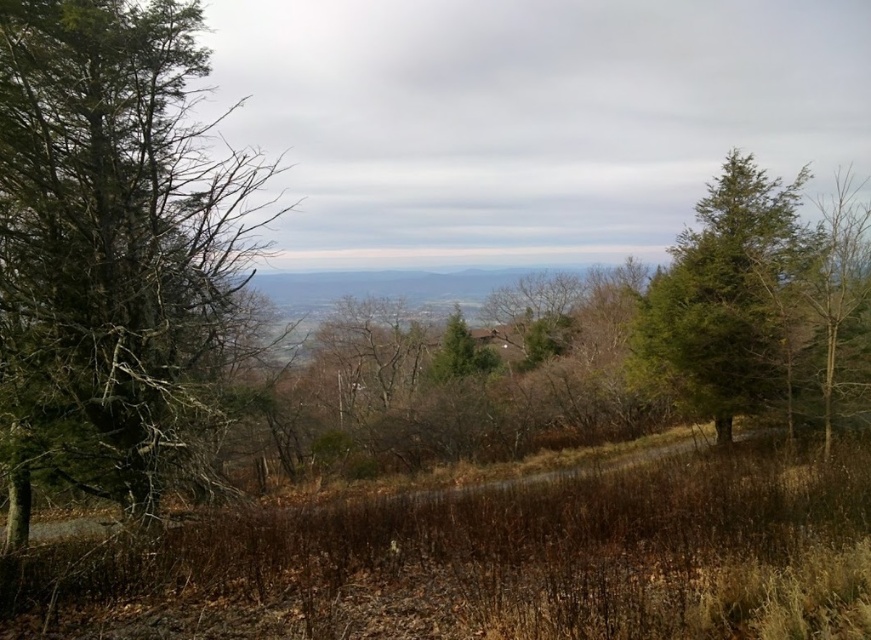
Question: Based on their relative distances, which object is nearer to the green matte tree at right?

Choices:
 (A) green needle-like tree at right
 (B) green matte tree at left

Answer: (A)

Question: Does green matte tree at left have a smaller size compared to green matte tree at right?

Choices:
 (A) yes
 (B) no

Answer: (A)

Question: Is green matte tree at left to the left of green matte tree at right from the viewer's perspective?

Choices:
 (A) no
 (B) yes

Answer: (B)

Question: Which object appears closest to the camera in this image?

Choices:
 (A) green needle-like tree at right
 (B) green matte tree at left
 (C) green matte tree at right

Answer: (B)

Question: Can you confirm if green needle-like tree at right is positioned above green matte tree at right?

Choices:
 (A) no
 (B) yes

Answer: (A)

Question: Which point is farther to the camera?

Choices:
 (A) (726, 161)
 (B) (26, 1)

Answer: (A)